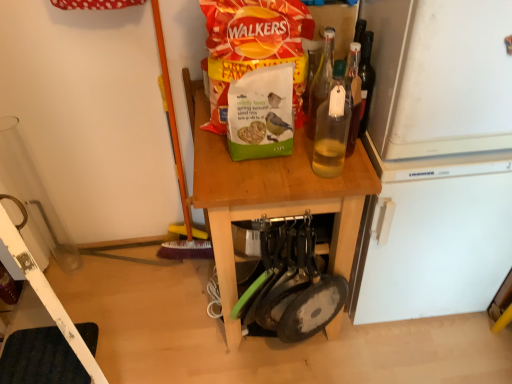
The height and width of the screenshot is (384, 512). Find the location of `free space to the back side of transparent glass bottle at center, which appears as the first bottle when viewed from the front`. free space to the back side of transparent glass bottle at center, which appears as the first bottle when viewed from the front is located at coordinates (311, 145).